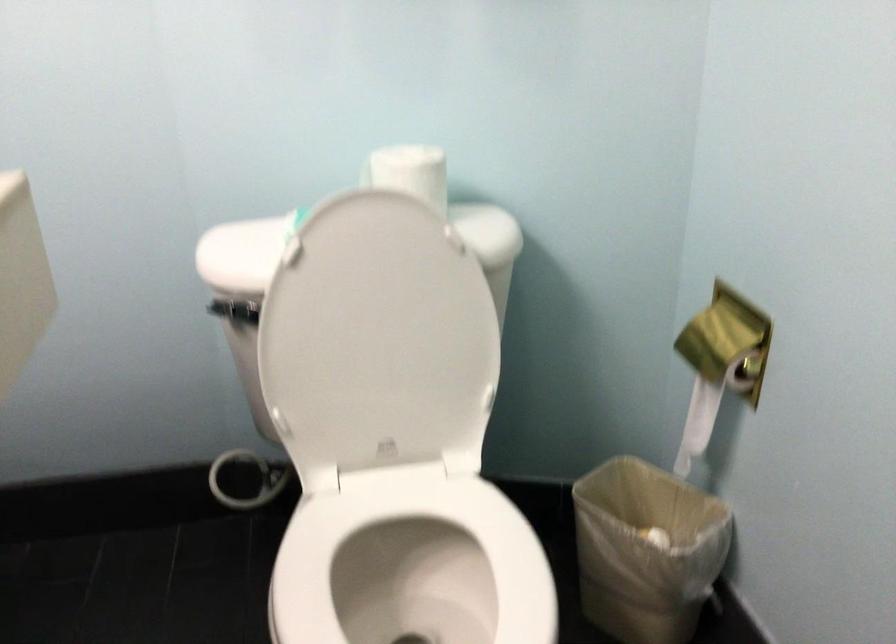
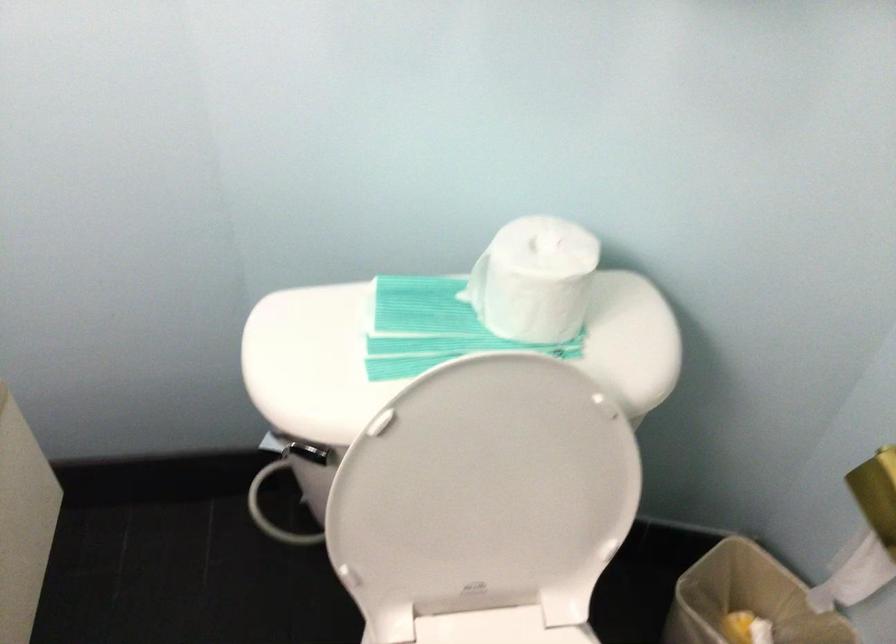
Find the pixel in the second image that matches point 376,335 in the first image.

(486, 496)